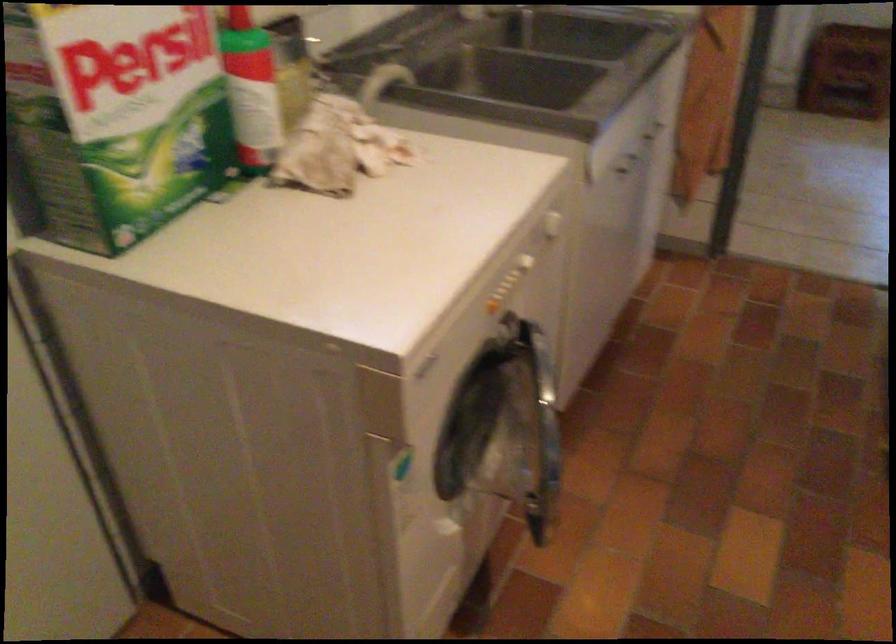
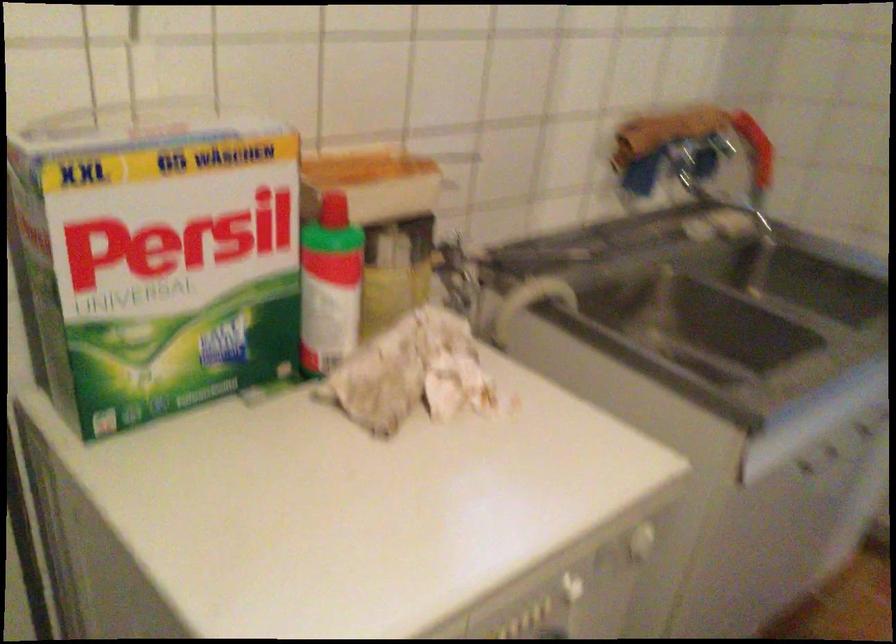
Question: The camera is either moving clockwise (left) or counter-clockwise (right) around the object. The first image is from the beginning of the video and the second image is from the end. Is the camera moving left or right when shooting the video?

Choices:
 (A) Left
 (B) Right

Answer: (B)